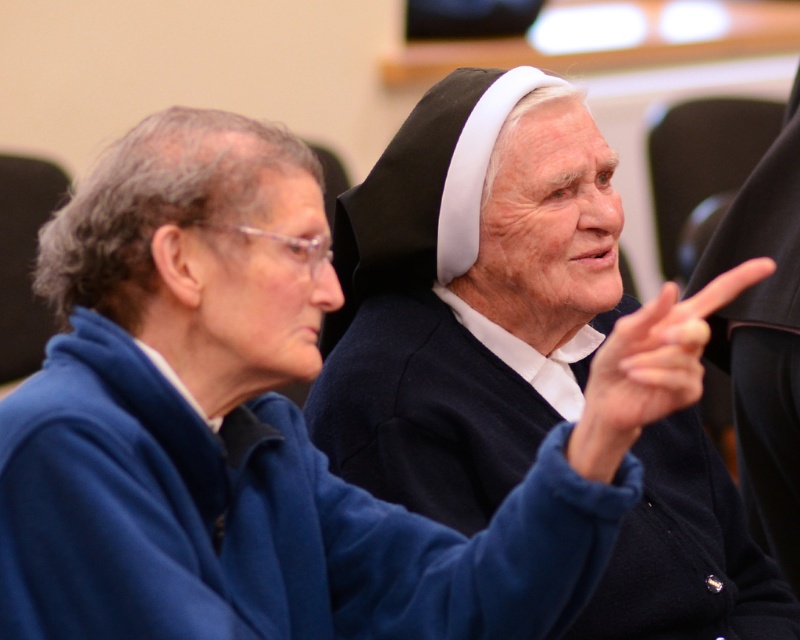
Is matte black nun's habit at upper center in front of blue fleece robe at center?

No.

Between point (696, 465) and point (138, 608), which one is positioned in front?

Point (138, 608) is in front.

Locate an element on the screen. matte black nun's habit at upper center is located at coordinates (462, 300).

Image resolution: width=800 pixels, height=640 pixels. Identify the location of matte black nun's habit at upper center. (462, 300).

Between point (470, 339) and point (740, 282), which one is positioned in front?

Point (740, 282)

Is point (492, 456) positioned before point (656, 356)?

That is False.

Where is `matte black nun's habit at upper center`? Image resolution: width=800 pixels, height=640 pixels. matte black nun's habit at upper center is located at coordinates (462, 300).

Does blue fleece robe at center appear on the right side of smooth skin finger at center?

In fact, blue fleece robe at center is to the left of smooth skin finger at center.

Who is lower down, blue fleece robe at center or smooth skin finger at center?

blue fleece robe at center is lower down.

In the scene shown: Who is more forward, (x=66, y=380) or (x=672, y=380)?

Point (x=672, y=380) is more forward.

This screenshot has width=800, height=640. Find the location of `blue fleece robe at center`. blue fleece robe at center is located at coordinates (258, 522).